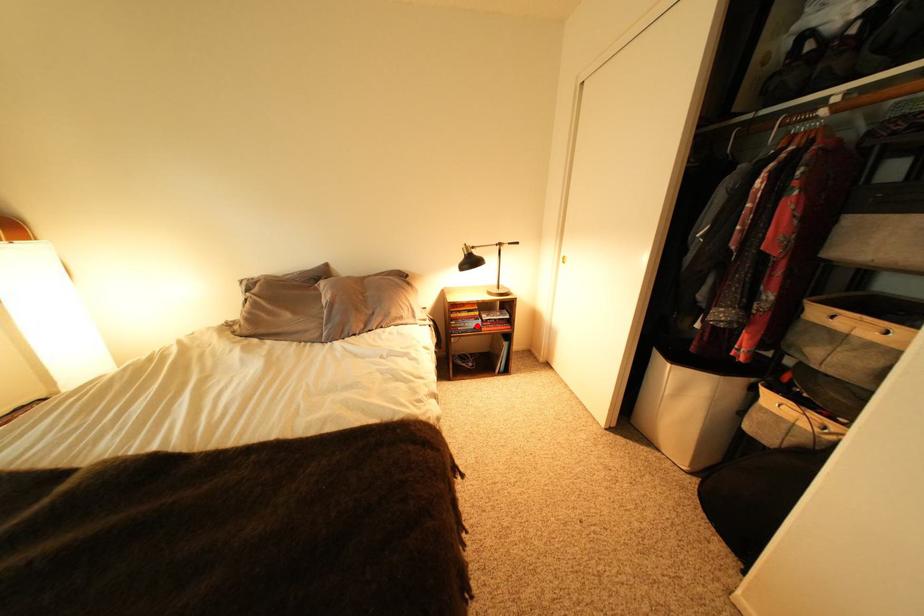
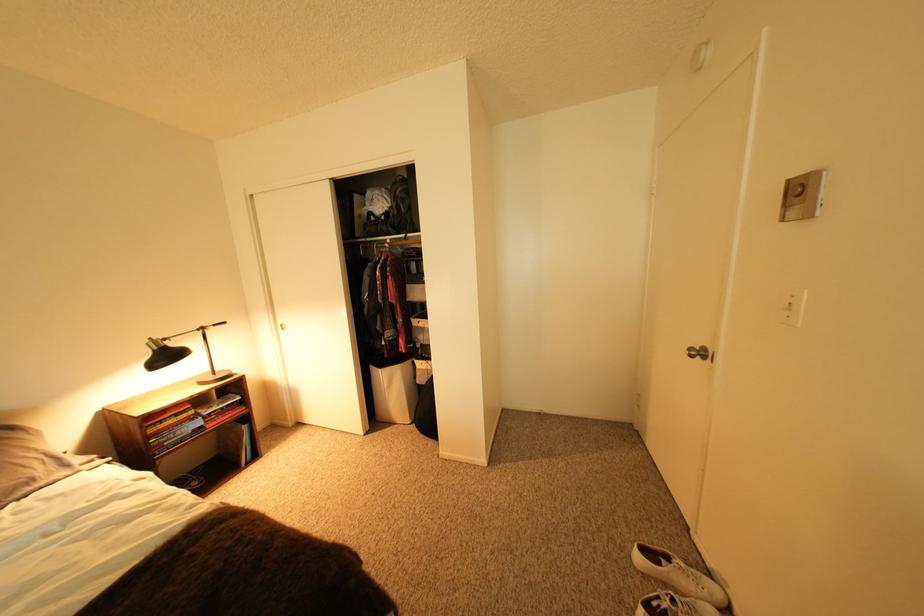
Find the pixel in the second image that matches the highlighted location in the first image.

(188, 435)